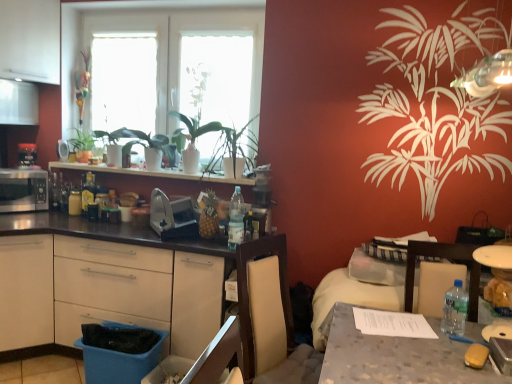
Describe the element at coordinates (236, 219) in the screenshot. I see `translucent plastic bottle at center, which ranks as the second bottle in right-to-left order` at that location.

Describe the element at coordinates (149, 173) in the screenshot. I see `white glossy shelf at upper center` at that location.

What do you see at coordinates (63, 150) in the screenshot?
I see `metallic silver toaster at upper left, the 2th appliance viewed from the right` at bounding box center [63, 150].

Image resolution: width=512 pixels, height=384 pixels. I want to click on metallic silver toaster at upper left, the third appliance viewed from the left, so click(x=63, y=150).

At what (x,y) coordinates should I click in order to perform the action: click on white glass window at upper center. Please return your answer as a coordinate pair (x, y). The width and height of the screenshot is (512, 384). Looking at the image, I should click on (160, 52).

The height and width of the screenshot is (384, 512). Describe the element at coordinates (82, 146) in the screenshot. I see `green leafy plant at left` at that location.

Where is `transparent glass window screen at upper center, acting as the first window screen starting from the left`? This screenshot has width=512, height=384. transparent glass window screen at upper center, acting as the first window screen starting from the left is located at coordinates (124, 81).

From the image's perspective, is white matte window screen at upper center, which ranks as the 1th window screen in right-to-left order, above matte silver microwave at left, the first appliance viewed from the left?

Yes, from the image's perspective, white matte window screen at upper center, which ranks as the 1th window screen in right-to-left order, is above matte silver microwave at left, the first appliance viewed from the left.

Looking at their sizes, would you say white matte window screen at upper center, which ranks as the 1th window screen in right-to-left order, is wider or thinner than matte silver microwave at left, the first appliance viewed from the left?

Clearly, white matte window screen at upper center, which ranks as the 1th window screen in right-to-left order, has less width compared to matte silver microwave at left, the first appliance viewed from the left.

Is white matte window screen at upper center, the second window screen positioned from the left, placed right next to matte silver microwave at left, arranged as the 4th appliance when viewed from the right?

No.

Is white matte window screen at upper center, which ranks as the 1th window screen in right-to-left order, wider or thinner than white glossy shelf at upper center?

In the image, white matte window screen at upper center, which ranks as the 1th window screen in right-to-left order, appears to be more narrow than white glossy shelf at upper center.

From the image's perspective, who appears lower, white matte window screen at upper center, the second window screen positioned from the left, or white glossy shelf at upper center?

white glossy shelf at upper center appears lower in the image.

From a real-world perspective, is white matte window screen at upper center, which ranks as the 1th window screen in right-to-left order, positioned under white glossy shelf at upper center based on gravity?

No.

Is white matte window screen at upper center, which ranks as the 1th window screen in right-to-left order, with white glossy shelf at upper center?

They are not placed beside each other.

Which of these two, clear plastic bottle at table right, the third bottle when ordered from back to front, or black matte countertop at left, is wider?

black matte countertop at left.

Is clear plastic bottle at table right, the 3th bottle when ordered from left to right, far away from black matte countertop at left?

Yes, clear plastic bottle at table right, the 3th bottle when ordered from left to right, is far from black matte countertop at left.

From the image's perspective, is clear plastic bottle at table right, which is the 1th bottle in front-to-back order, above or below black matte countertop at left?

From the image's perspective, clear plastic bottle at table right, which is the 1th bottle in front-to-back order, appears above black matte countertop at left.

Which is behind, clear plastic bottle at table right, the third bottle when ordered from back to front, or black matte countertop at left?

black matte countertop at left is further away from the camera.

What's the angular difference between metallic silver toaster at left, placed as the third appliance when sorted from right to left, and matte silver microwave at left, arranged as the 4th appliance when viewed from the right,'s facing directions?

1.25 degrees separate the facing orientations of metallic silver toaster at left, placed as the third appliance when sorted from right to left, and matte silver microwave at left, arranged as the 4th appliance when viewed from the right.

Can you confirm if metallic silver toaster at left, placed as the third appliance when sorted from right to left, is smaller than matte silver microwave at left, the first appliance viewed from the left?

Correct, metallic silver toaster at left, placed as the third appliance when sorted from right to left, occupies less space than matte silver microwave at left, the first appliance viewed from the left.

Considering the positions of objects metallic silver toaster at left, placed as the third appliance when sorted from right to left, and matte silver microwave at left, the first appliance viewed from the left, in the image provided, who is behind, metallic silver toaster at left, placed as the third appliance when sorted from right to left, or matte silver microwave at left, the first appliance viewed from the left,?

metallic silver toaster at left, placed as the third appliance when sorted from right to left, is further away from the camera.

Between metallic silver toaster at left, placed as the 2th appliance when sorted from left to right, and matte silver microwave at left, the first appliance viewed from the left, which one appears on the left side from the viewer's perspective?

Positioned to the left is matte silver microwave at left, the first appliance viewed from the left.

In the image, is black matte countertop at left on the left side or the right side of clear plastic bottle at table right, which is the first bottle from right to left?

Based on their positions, black matte countertop at left is located to the left of clear plastic bottle at table right, which is the first bottle from right to left.

Can you confirm if black matte countertop at left is shorter than clear plastic bottle at table right, which is the first bottle from right to left?

In fact, black matte countertop at left may be taller than clear plastic bottle at table right, which is the first bottle from right to left.

Is there a large distance between black matte countertop at left and clear plastic bottle at table right, the third bottle when ordered from back to front?

black matte countertop at left is positioned a significant distance from clear plastic bottle at table right, the third bottle when ordered from back to front.

In terms of size, does metallic silver toaster at upper left, the third appliance viewed from the left, appear bigger or smaller than blue plastic drawer at lower left?

→ Considering their sizes, metallic silver toaster at upper left, the third appliance viewed from the left, takes up less space than blue plastic drawer at lower left.

How different are the orientations of metallic silver toaster at upper left, the 2th appliance viewed from the right, and blue plastic drawer at lower left in degrees?

They differ by 0.964 degrees in their facing directions.

Does metallic silver toaster at upper left, the 2th appliance viewed from the right, have a greater height compared to blue plastic drawer at lower left?

Correct, metallic silver toaster at upper left, the 2th appliance viewed from the right, is much taller as blue plastic drawer at lower left.

Looking at this image, considering the relative positions of metallic silver toaster at upper left, the 2th appliance viewed from the right, and blue plastic drawer at lower left in the image provided, is metallic silver toaster at upper left, the 2th appliance viewed from the right, to the left or to the right of blue plastic drawer at lower left?

Based on their positions, metallic silver toaster at upper left, the 2th appliance viewed from the right, is located to the left of blue plastic drawer at lower left.

From a real-world perspective, is translucent plastic bottle at center, which ranks as the second bottle in right-to-left order, over blue plastic drawer at lower left?

Yes, from a real-world perspective, translucent plastic bottle at center, which ranks as the second bottle in right-to-left order, is above blue plastic drawer at lower left.

Based on the photo, considering the sizes of translucent plastic bottle at center, the 2th bottle positioned from the front, and blue plastic drawer at lower left in the image, is translucent plastic bottle at center, the 2th bottle positioned from the front, taller or shorter than blue plastic drawer at lower left?

Considering their sizes, translucent plastic bottle at center, the 2th bottle positioned from the front, has more height than blue plastic drawer at lower left.

Can you confirm if translucent plastic bottle at center, which ranks as the second bottle in right-to-left order, is positioned to the right of blue plastic drawer at lower left?

Yes.

There is a white matte window screen at upper center, the second window screen positioned from the left. At what (x,y) coordinates should I click in order to perform the action: click on the 3rd appliance below it (from a real-world perspective). Please return your answer as a coordinate pair (x, y). The width and height of the screenshot is (512, 384). Looking at the image, I should click on (23, 190).

The image size is (512, 384). I want to click on window screen that is the 2nd one above the white glossy shelf at upper center (from a real-world perspective), so click(x=218, y=92).

Based on their spatial positions, is translucent plastic bottle at center, which is the 2th bottle in left-to-right order, or clear plastic bottle at table right, which is the 1th bottle in front-to-back order, closer to white glass window at upper center?

Based on the image, translucent plastic bottle at center, which is the 2th bottle in left-to-right order, appears to be nearer to white glass window at upper center.

Looking at the image, which one is located closer to white matte window screen at upper center, the second window screen positioned from the left, satin silver toaster at center, acting as the fourth appliance starting from the left, or metallic silver toaster at upper left, the 2th appliance viewed from the right?

satin silver toaster at center, acting as the fourth appliance starting from the left.

From the image, which object appears to be farther from transparent glass window screen at upper center, placed as the 2th window screen when sorted from right to left, white matte window screen at upper center, the second window screen positioned from the left, or metallic silver toaster at upper left, the 2th appliance viewed from the right?

The object further to transparent glass window screen at upper center, placed as the 2th window screen when sorted from right to left, is metallic silver toaster at upper left, the 2th appliance viewed from the right.

Based on their spatial positions, is clear plastic bottle at table right, which is the first bottle from right to left, or black matte countertop at left further from transparent glass window screen at upper center, placed as the 2th window screen when sorted from right to left?

Based on the image, clear plastic bottle at table right, which is the first bottle from right to left, appears to be further to transparent glass window screen at upper center, placed as the 2th window screen when sorted from right to left.

Considering their positions, is satin silver toaster at center, acting as the first appliance starting from the right, positioned closer to white matte window screen at upper center, which ranks as the 1th window screen in right-to-left order, than clear plastic bottle at table right, the 3th bottle when ordered from left to right?

satin silver toaster at center, acting as the first appliance starting from the right, lies closer to white matte window screen at upper center, which ranks as the 1th window screen in right-to-left order, than the other object.

Considering their positions, is black matte countertop at left positioned closer to white matte window screen at upper center, which ranks as the 1th window screen in right-to-left order, than satin silver toaster at center, acting as the fourth appliance starting from the left?

Among the two, satin silver toaster at center, acting as the fourth appliance starting from the left, is located nearer to white matte window screen at upper center, which ranks as the 1th window screen in right-to-left order.

Based on their spatial positions, is matte glass bottle at left, arranged as the 1th bottle when viewed from the left, or blue plastic drawer at lower left further from metallic silver toaster at left, placed as the third appliance when sorted from right to left?

Based on the image, blue plastic drawer at lower left appears to be further to metallic silver toaster at left, placed as the third appliance when sorted from right to left.

When comparing their distances from black matte countertop at left, does white matte window screen at upper center, which ranks as the 1th window screen in right-to-left order, or matte glass bottle at left, which is counted as the 1th bottle, starting from the back, seem further?

white matte window screen at upper center, which ranks as the 1th window screen in right-to-left order.

Locate an element on the screen. Image resolution: width=512 pixels, height=384 pixels. drawer between matte silver microwave at left, arranged as the 4th appliance when viewed from the right, and black matte countertop at left, in the horizontal direction is located at coordinates (93, 321).

Locate an element on the screen. window between green leafy plant at left and translucent plastic bottle at center, which ranks as the second bottle in right-to-left order, in the horizontal direction is located at coordinates (160, 52).

The width and height of the screenshot is (512, 384). I want to click on window situated between metallic silver toaster at left, placed as the third appliance when sorted from right to left, and white matte window screen at upper center, the second window screen positioned from the left, from left to right, so click(160, 52).

The width and height of the screenshot is (512, 384). Identify the location of houseplant located between metallic silver toaster at left, placed as the third appliance when sorted from right to left, and matte glass bottle at left, which is counted as the 1th bottle, starting from the back, in the left-right direction. (82, 146).